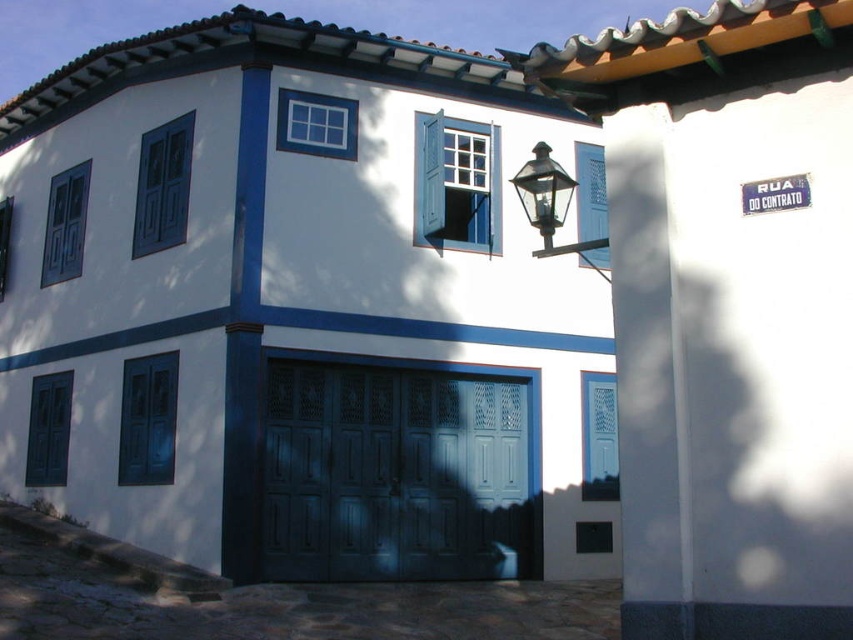
You are standing in front of the two story colonial style building. You see a point at coordinates (x=393, y=474). What object is located at that point?

The point at coordinates (x=393, y=474) corresponds to the dark wood glass garage door at center.